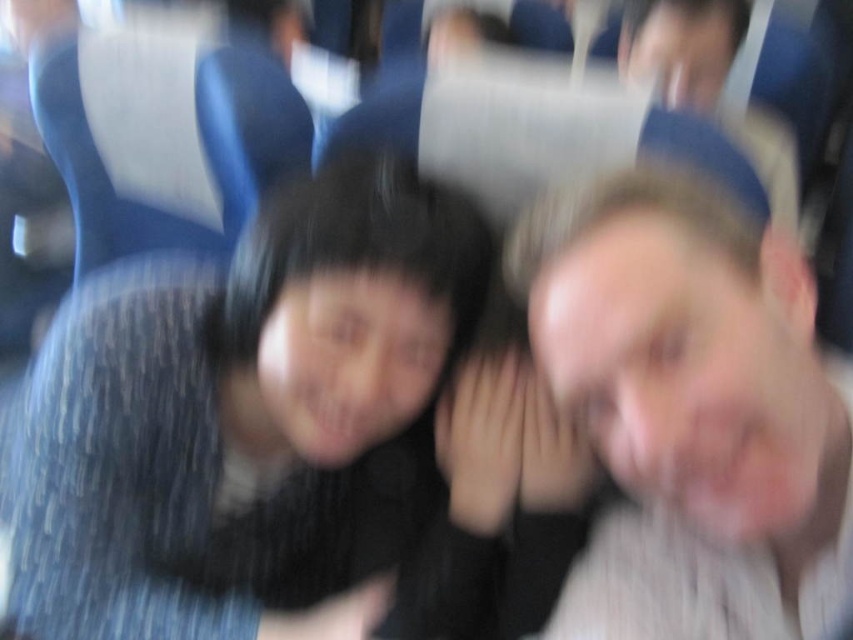
Which of these two, matte black hair at center or smooth skin face at right, stands taller?

With more height is matte black hair at center.

Is point (84, 544) farther from camera compared to point (782, 324)?

Yes, it is.

Is point (407, 492) positioned in front of point (613, 259)?

That is False.

Locate an element on the screen. The height and width of the screenshot is (640, 853). matte black hair at center is located at coordinates (241, 412).